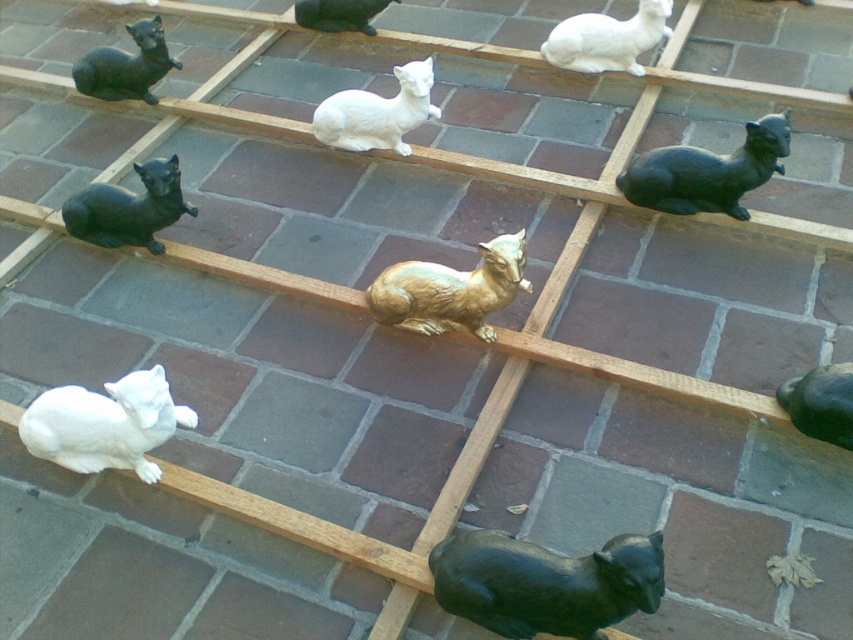
You are arranging animal figurines on a tiled floor. You have a white glossy goat at center and a white glossy goat at upper center. Which one is directly above the other?

The white glossy goat at upper center is directly above the white glossy goat at center.

You are arranging animal figurines on a tiled floor. You have a matte black cat at upper right and a white glossy goat at center. Which figurine takes up more space on the tiles?

The white glossy goat at center takes up more space than the matte black cat at upper right.